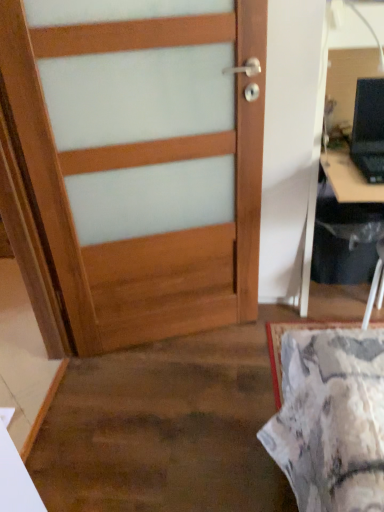
Question: From the image's perspective, is black plastic computer desk at right positioned above or below wooden door at center?

Choices:
 (A) above
 (B) below

Answer: (A)

Question: Is black plastic computer desk at right in front of or behind wooden door at center in the image?

Choices:
 (A) behind
 (B) front

Answer: (B)

Question: Considering the real-world distances, which object is closest to the wooden door at center?

Choices:
 (A) black plastic laptop at upper right
 (B) black plastic computer desk at right

Answer: (B)

Question: Based on their relative distances, which object is nearer to the black plastic computer desk at right?

Choices:
 (A) black plastic laptop at upper right
 (B) wooden door at center

Answer: (A)